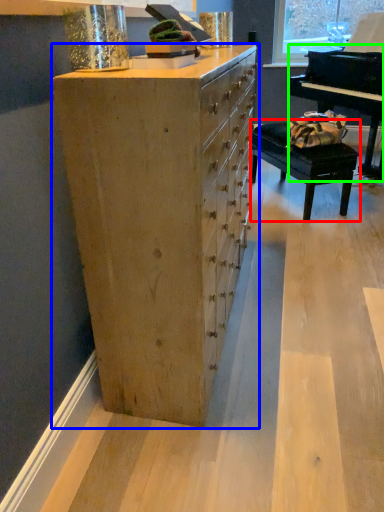
Question: Based on their relative distances, which object is farther from table (highlighted by a red box)? Choose from chest of drawers (highlighted by a blue box) and piano (highlighted by a green box).

Choices:
 (A) chest of drawers
 (B) piano

Answer: (A)